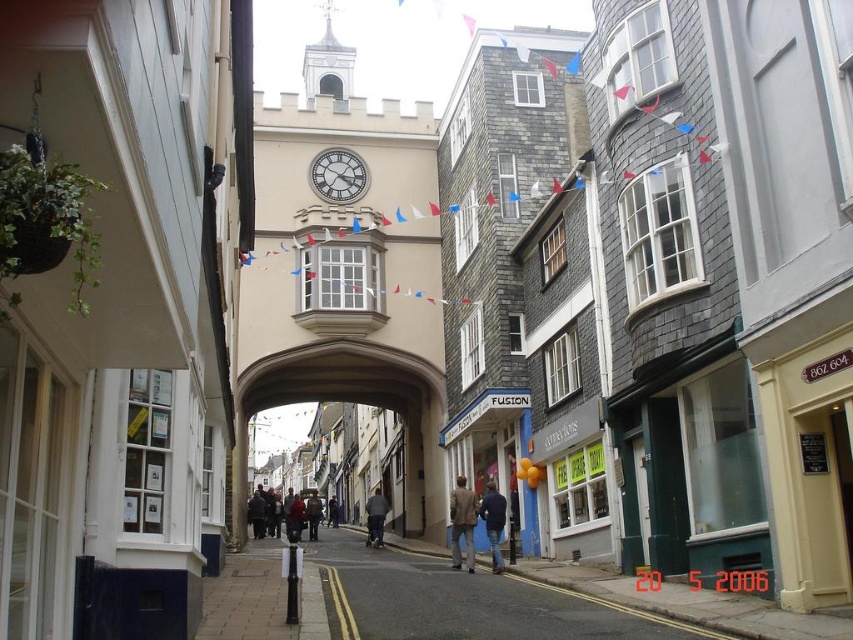
Question: Is smooth asphalt road at center further to camera compared to dark gray jacket at center?

Choices:
 (A) yes
 (B) no

Answer: (B)

Question: Is smooth asphalt road at center further to the viewer compared to white wooden clock at center?

Choices:
 (A) yes
 (B) no

Answer: (B)

Question: Which of the following is the farthest from the observer?

Choices:
 (A) (309, 516)
 (B) (461, 488)
 (C) (378, 532)

Answer: (A)

Question: Among these points, which one is farthest from the camera?

Choices:
 (A) (369, 522)
 (B) (231, 602)
 (C) (491, 486)

Answer: (A)

Question: Does dark gray jacket at center come in front of dark brown leather jacket at center?

Choices:
 (A) no
 (B) yes

Answer: (B)

Question: Which object is closer to the camera taking this photo?

Choices:
 (A) blue denim jacket at center
 (B) dark brown leather jacket at center

Answer: (A)